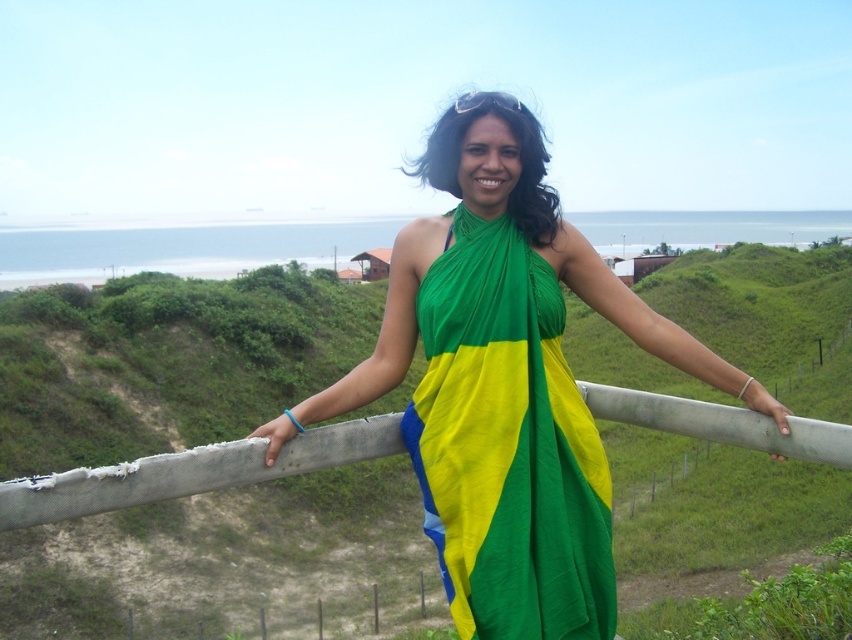
You are a fashion designer observing the scene. You notice the green fabric at center and the green fabric dress at center. Which one is shorter in height?

The green fabric at center is shorter than the green fabric dress at center.

You are a photographer trying to capture the green fabric at center and the green fabric dress at center. Which one should you focus on first if you want to take a sharp photo of both?

You should focus on the green fabric dress at center first because it is closer to you than the green fabric at center, which is further away, allowing both to be in focus when using a proper aperture setting.

You are an observer looking at the scene. You notice two items labeled as green fabric at center and green fabric dress at center. Which one is positioned more to the right?

The green fabric at center is positioned more to the right than the green fabric dress at center.